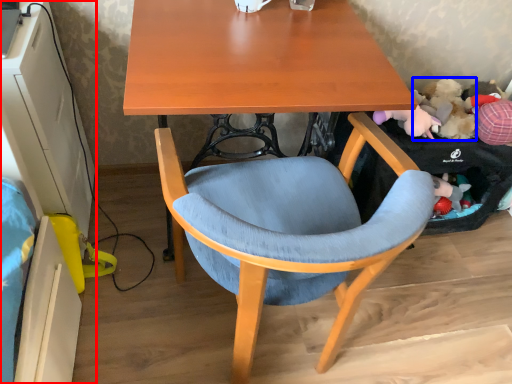
Question: Which object is closer to the camera taking this photo, computer desk (highlighted by a red box) or toy (highlighted by a blue box)?

Choices:
 (A) computer desk
 (B) toy

Answer: (A)